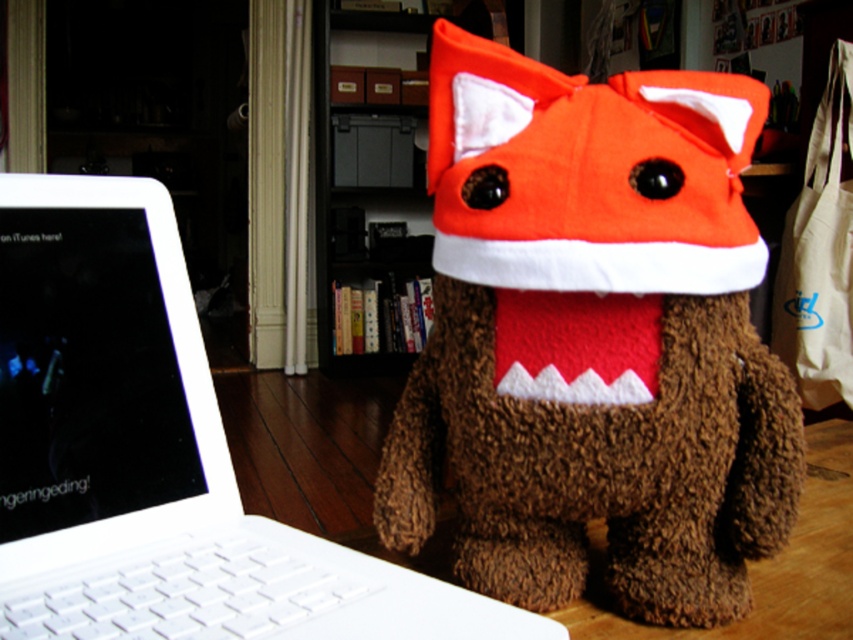
Which is behind, point (581, 244) or point (412, 13)?

The point (412, 13) is behind.

Is orange plush hat at center to the right of wooden bookshelf at center from the viewer's perspective?

Correct, you'll find orange plush hat at center to the right of wooden bookshelf at center.

Does point (466, 74) come in front of point (372, 275)?

Yes.

Image resolution: width=853 pixels, height=640 pixels. What are the coordinates of `orange plush hat at center` in the screenshot? It's located at 589,173.

Can you confirm if brown fuzzy stuffed toy at center is positioned to the right of white plastic laptop at lower left?

Indeed, brown fuzzy stuffed toy at center is positioned on the right side of white plastic laptop at lower left.

Is point (577, 540) closer to camera compared to point (44, 317)?

No, (577, 540) is behind (44, 317).

Which is behind, point (627, 150) or point (131, 588)?

The point (131, 588) is more distant.

Where is `brown fuzzy stuffed toy at center`? The width and height of the screenshot is (853, 640). brown fuzzy stuffed toy at center is located at coordinates point(593,339).

Measure the distance between point (28, 477) and camera.

Point (28, 477) and camera are 18.76 inches apart from each other.

Is point (88, 362) closer to camera compared to point (430, 68)?

No, (88, 362) is further to viewer.

Is point (106, 628) closer to viewer compared to point (527, 77)?

Yes.

This screenshot has width=853, height=640. What are the coordinates of `white plastic laptop at lower left` in the screenshot? It's located at (154, 454).